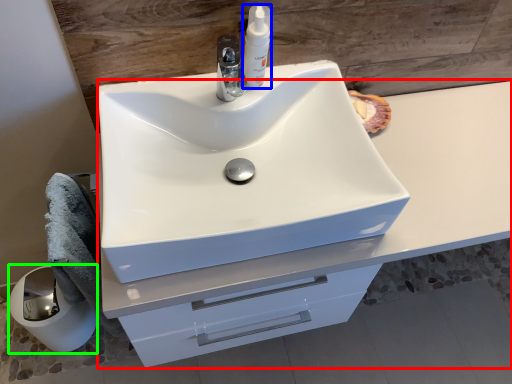
Question: Based on their relative distances, which object is farther from bathroom cabinet (highlighted by a red box)? Choose from soap dispenser (highlighted by a blue box) and paper towel (highlighted by a green box).

Choices:
 (A) soap dispenser
 (B) paper towel

Answer: (B)